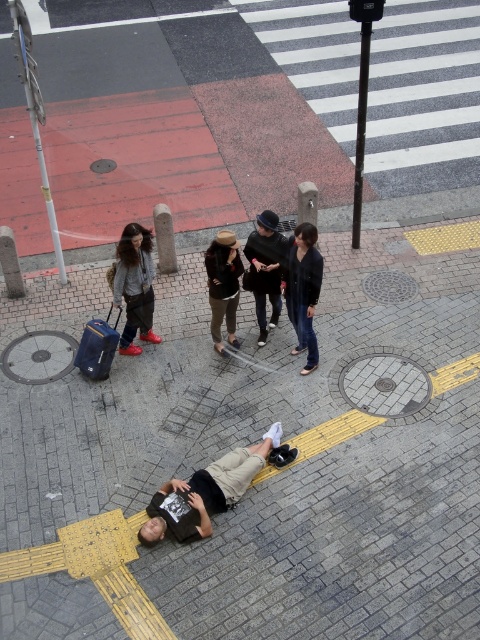
Question: Which point is closer to the camera?

Choices:
 (A) black leather jacket at center
 (B) black matte skateboard at lower center
 (C) brick pavement at center

Answer: (C)

Question: Can you confirm if brick pavement at center is positioned above black matte skateboard at lower center?

Choices:
 (A) no
 (B) yes

Answer: (A)

Question: Among these points, which one is farthest from the camera?

Choices:
 (A) (472, 257)
 (B) (259, 468)

Answer: (A)

Question: Does black matte skateboard at lower center appear over black leather jacket at center?

Choices:
 (A) yes
 (B) no

Answer: (B)

Question: Can you confirm if black matte skateboard at lower center is positioned to the right of black leather jacket at center?

Choices:
 (A) yes
 (B) no

Answer: (B)

Question: Based on their relative distances, which object is nearer to the brick pavement at center?

Choices:
 (A) black leather jacket at center
 (B) black matte skateboard at lower center

Answer: (B)